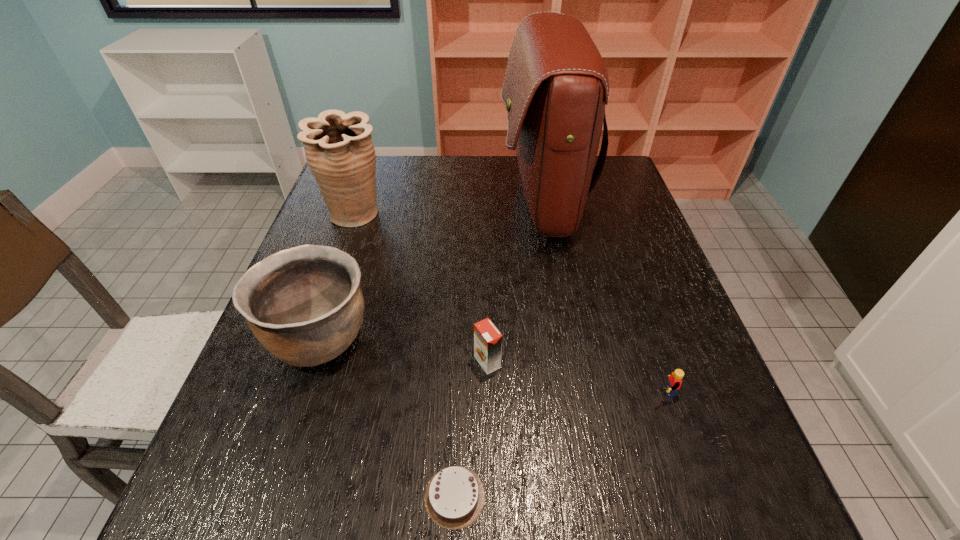
Locate an element on the screen. the fifth closest object to the fifth shortest object is located at coordinates (674, 381).

Image resolution: width=960 pixels, height=540 pixels. What are the coordinates of `object that can be found as the fifth closest to the Lego` in the screenshot? It's located at (339, 150).

Where is `vacant space that satisfies the following two spatial constraints: 1. on the front side of the fifth shortest object; 2. on the left side of the chocolate cake`? vacant space that satisfies the following two spatial constraints: 1. on the front side of the fifth shortest object; 2. on the left side of the chocolate cake is located at coordinates (259, 496).

Where is `free space that satisfies the following two spatial constraints: 1. on the front-facing side of the Lego; 2. on the front side of the chocolate cake`? The width and height of the screenshot is (960, 540). free space that satisfies the following two spatial constraints: 1. on the front-facing side of the Lego; 2. on the front side of the chocolate cake is located at coordinates (695, 496).